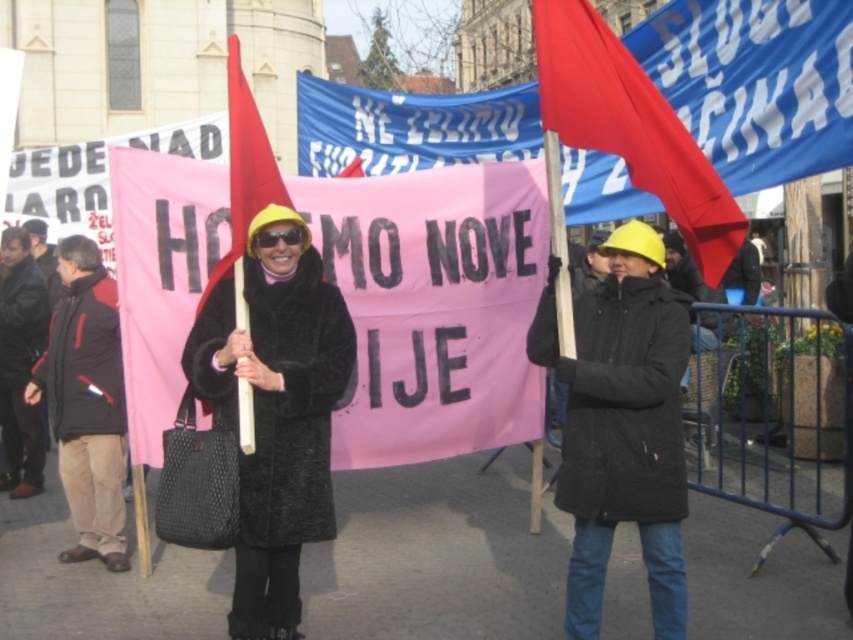
Does point (212, 378) come behind point (61, 445)?

No.

Does velvet black coat at center appear over black fabric jacket at left?

No, velvet black coat at center is not above black fabric jacket at left.

Measure the distance between velvet black coat at center and camera.

The distance of velvet black coat at center from camera is 46.04 feet.

Identify the location of velvet black coat at center. The height and width of the screenshot is (640, 853). (276, 410).

Which is above, blue fabric banner at center or black leather jacket at left?

Positioned higher is blue fabric banner at center.

Can you confirm if blue fabric banner at center is smaller than black leather jacket at left?

Actually, blue fabric banner at center might be larger than black leather jacket at left.

The width and height of the screenshot is (853, 640). I want to click on blue fabric banner at center, so click(x=412, y=125).

The width and height of the screenshot is (853, 640). What are the coordinates of `blue fabric banner at center` in the screenshot? It's located at (412, 125).

Who is lower down, matte black coat at center or velvet black coat at center?

velvet black coat at center is lower down.

Is matte black coat at center in front of velvet black coat at center?

Result: No, it is not.

Is point (604, 515) behind point (231, 381)?

No, (604, 515) is closer to viewer.

This screenshot has width=853, height=640. I want to click on matte black coat at center, so click(622, 428).